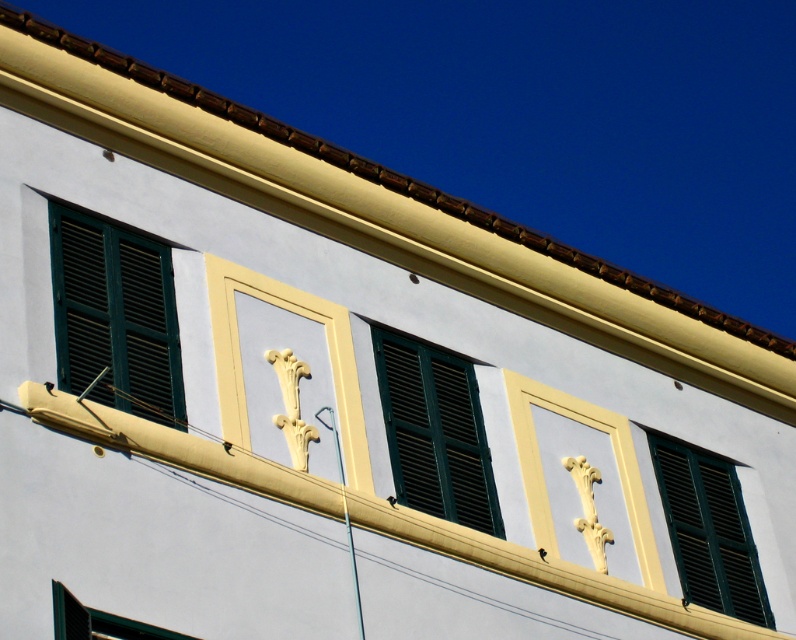
Which is more to the left, green matte shutters at center or green matte shutters at right?

Positioned to the left is green matte shutters at center.

Who is shorter, green matte shutters at center or green matte shutters at right?

green matte shutters at center

Between point (475, 497) and point (752, 602), which one is positioned in front?

Positioned in front is point (475, 497).

Identify the location of green matte shutters at center. Image resolution: width=796 pixels, height=640 pixels. (434, 433).

Which is more to the left, green matte shutters at left or green matte shutters at right?

green matte shutters at left is more to the left.

Does green matte shutters at left have a lesser height compared to green matte shutters at right?

Yes, green matte shutters at left is shorter than green matte shutters at right.

What do you see at coordinates (115, 316) in the screenshot?
I see `green matte shutters at left` at bounding box center [115, 316].

What are the coordinates of `green matte shutters at left` in the screenshot? It's located at (115, 316).

Is point (172, 422) in front of point (431, 464)?

Yes, point (172, 422) is closer to viewer.

Describe the element at coordinates (115, 316) in the screenshot. The image size is (796, 640). I see `green matte shutters at left` at that location.

Where is `green matte shutters at left`? The image size is (796, 640). green matte shutters at left is located at coordinates (115, 316).